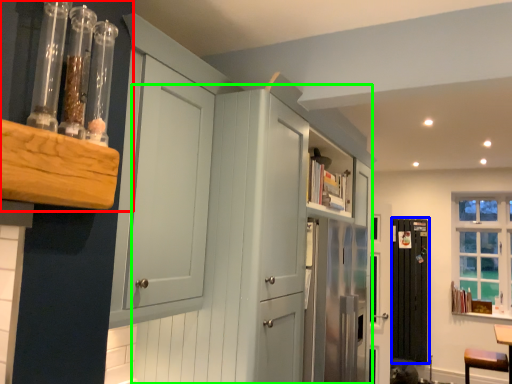
Question: Which is farther away from shelf (highlighted by a red box)? screen door (highlighted by a blue box) or dresser (highlighted by a green box)?

Choices:
 (A) screen door
 (B) dresser

Answer: (A)